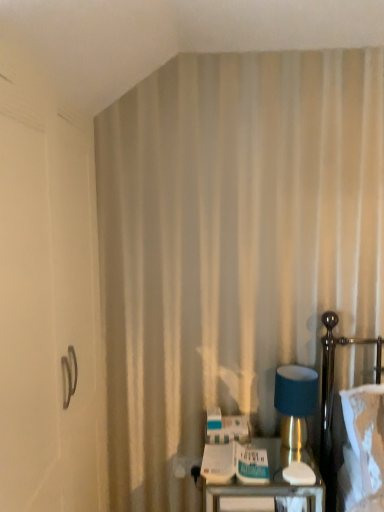
The height and width of the screenshot is (512, 384). What are the coordinates of `blank space situated above metallic silver tray at lower right (from a real-world perspective)` in the screenshot? It's located at (254, 453).